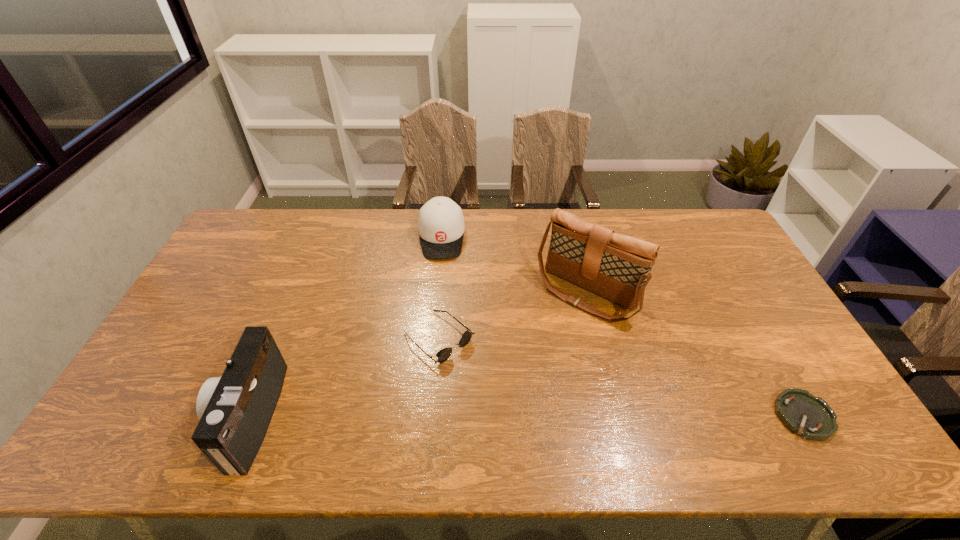
The height and width of the screenshot is (540, 960). Identify the location of free space at the right edge of the desktop. (736, 255).

Identify the location of vacant space at the far left corner. This screenshot has height=540, width=960. (270, 215).

You are a GUI agent. You are given a task and a screenshot of the screen. Output one action in this format:
    pyautogui.click(x=<x>, y=<y>)
    Task: Click on the vacant space at the far right corner of the desktop
    Image resolution: width=960 pixels, height=540 pixels.
    Given the screenshot: What is the action you would take?
    pyautogui.click(x=705, y=211)

The image size is (960, 540). What are the coordinates of `free space between the second tallest object and the shortest object` in the screenshot? It's located at (526, 416).

This screenshot has width=960, height=540. What are the coordinates of `vacant space that is in between the shoulder bag and the shortest object` in the screenshot? It's located at (695, 354).

Identify the location of vacant point located between the fourth object from left to right and the shortest object. (695, 354).

Locate an element on the screen. This screenshot has height=540, width=960. free space between the fourth shortest object and the baseball cap is located at coordinates [345, 327].

Identify the location of vacant region between the leftmost object and the shortest object. The width and height of the screenshot is (960, 540). (526, 416).

Where is `free spot between the fourth shortest object and the tallest object`? The height and width of the screenshot is (540, 960). free spot between the fourth shortest object and the tallest object is located at coordinates (418, 354).

Identify the location of free area in between the rightmost object and the baseball cap. (622, 327).